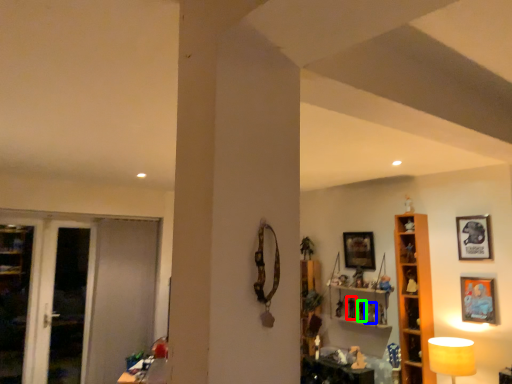
Question: Considering the real-world distances, which object is farthest from toy (highlighted by a red box)? toy (highlighted by a blue box) or toy (highlighted by a green box)?

Choices:
 (A) toy
 (B) toy

Answer: (A)